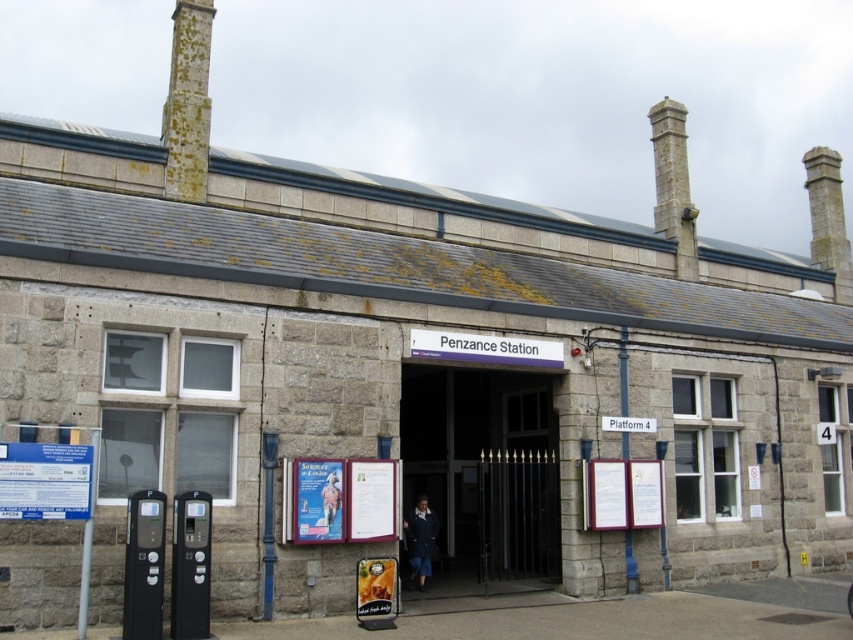
Who is lower down, smooth stone gate at center or green mossy stone chimney at upper left?

smooth stone gate at center is below.

Between smooth stone gate at center and green mossy stone chimney at upper left, which one has more height?

With more height is green mossy stone chimney at upper left.

Where is `smooth stone gate at center`? smooth stone gate at center is located at coordinates (485, 468).